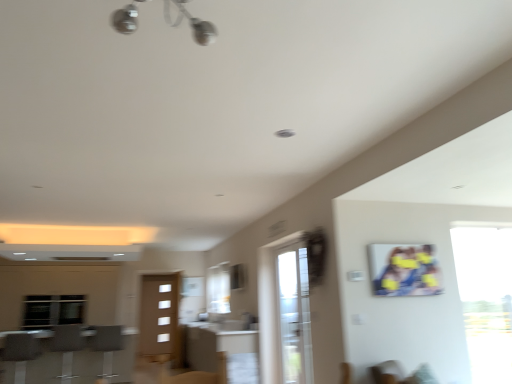
Question: Can you confirm if transparent glass window at right is wider than clear glass screen door at center?

Choices:
 (A) yes
 (B) no

Answer: (B)

Question: Are transparent glass window at right and clear glass screen door at center far apart?

Choices:
 (A) yes
 (B) no

Answer: (A)

Question: From the image's perspective, is transparent glass window at right above clear glass screen door at center?

Choices:
 (A) no
 (B) yes

Answer: (B)

Question: From the image's perspective, is transparent glass window at right located beneath clear glass screen door at center?

Choices:
 (A) no
 (B) yes

Answer: (A)

Question: Is clear glass screen door at center at the back of transparent glass window at right?

Choices:
 (A) yes
 (B) no

Answer: (B)

Question: In terms of height, does transparent glass window at right look taller or shorter compared to metallic silver barstools at lower left?

Choices:
 (A) short
 (B) tall

Answer: (B)

Question: Based on their positions, is transparent glass window at right located to the left or right of metallic silver barstools at lower left?

Choices:
 (A) right
 (B) left

Answer: (A)

Question: From the image's perspective, is transparent glass window at right located above or below metallic silver barstools at lower left?

Choices:
 (A) below
 (B) above

Answer: (B)

Question: Considering the positions of point (485, 380) and point (78, 370), is point (485, 380) closer or farther from the camera than point (78, 370)?

Choices:
 (A) farther
 (B) closer

Answer: (B)

Question: Considering the positions of point (249, 354) and point (287, 258), is point (249, 354) closer or farther from the camera than point (287, 258)?

Choices:
 (A) closer
 (B) farther

Answer: (B)

Question: Based on their sizes in the image, would you say matte brown table at center is bigger or smaller than clear glass screen door at center?

Choices:
 (A) small
 (B) big

Answer: (B)

Question: From the image's perspective, is matte brown table at center above or below clear glass screen door at center?

Choices:
 (A) above
 (B) below

Answer: (B)

Question: Is matte brown table at center spatially inside clear glass screen door at center, or outside of it?

Choices:
 (A) outside
 (B) inside

Answer: (A)

Question: Would you say clear glass screen door at center is inside or outside transparent glass window at right?

Choices:
 (A) outside
 (B) inside

Answer: (A)

Question: Considering the positions of clear glass screen door at center and transparent glass window at right in the image, is clear glass screen door at center wider or thinner than transparent glass window at right?

Choices:
 (A) wide
 (B) thin

Answer: (A)